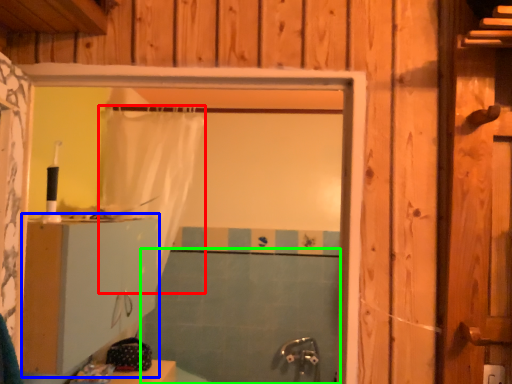
Question: Based on their relative distances, which object is farther from shower curtain (highlighted by a red box)? Choose from dresser (highlighted by a blue box) and bath (highlighted by a green box).

Choices:
 (A) dresser
 (B) bath

Answer: (B)